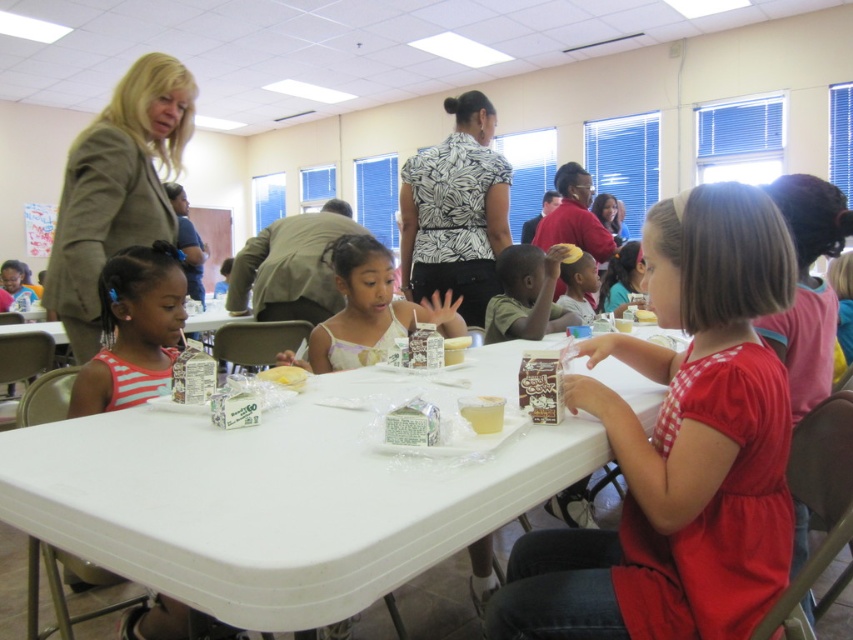
You are a photographer trying to capture a photo of the matte red dress at center and the white paper cupcake at center from above. Which object should you focus on first if you want to ensure both are in frame without moving the camera?

You should focus on the matte red dress at center first because it is taller than the white paper cupcake at center, so it will occupy more space in the frame.

You are a photographer setting up a camera to capture a group photo of the children at the table. You need to ensure that both the matte red dress at center and the striped fabric shirt at left are clearly visible in the frame. Given their sizes, which child should you position closer to the camera to ensure their clothing details are captured properly?

The striped fabric shirt at left should be positioned closer to the camera because it is narrower than the matte red dress at center. This adjustment will help ensure both garments are visible and their details are captured properly.